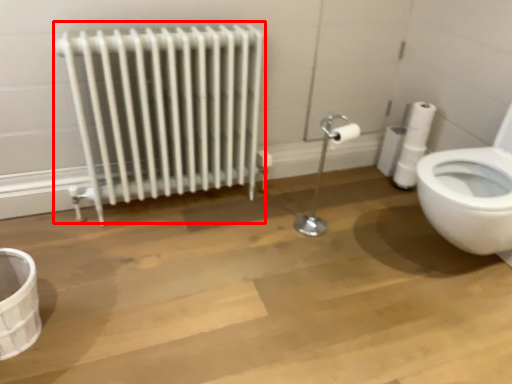
Question: From the image, what is the correct spatial relationship of radiator (annotated by the red box) in relation to toilet paper?

Choices:
 (A) left
 (B) right

Answer: (A)